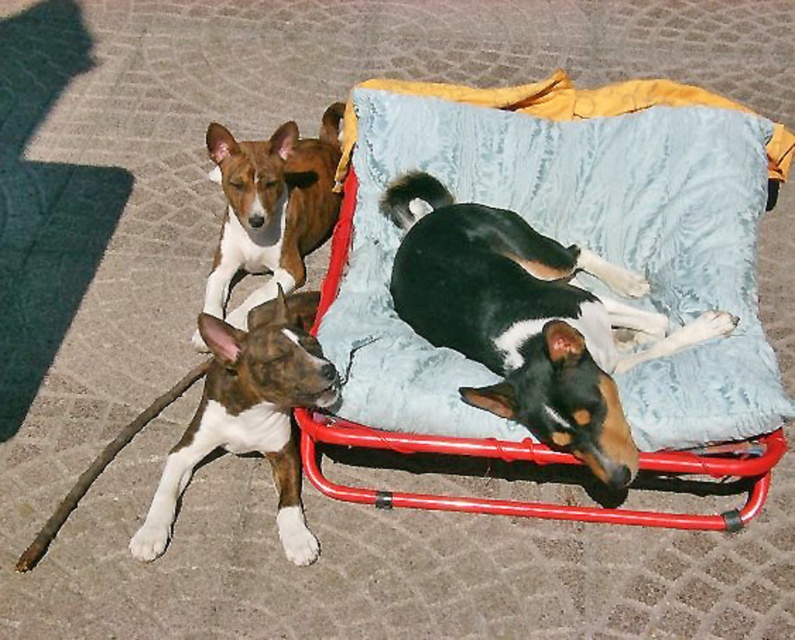
Question: Is black and white fur at center to the left of brown and white fur at lower left from the viewer's perspective?

Choices:
 (A) no
 (B) yes

Answer: (A)

Question: Which object is closer to the camera taking this photo?

Choices:
 (A) brown and white fur at lower left
 (B) black and white fur at center
 (C) brown/white fur dog at upper left
 (D) blue velvety blanket at upper center

Answer: (B)

Question: Does black and white fur at center have a greater width compared to brown and white fur at lower left?

Choices:
 (A) yes
 (B) no

Answer: (A)

Question: Considering the real-world distances, which object is farthest from the brown/white fur dog at upper left?

Choices:
 (A) blue velvety blanket at upper center
 (B) black and white fur at center
 (C) brown and white fur at lower left

Answer: (B)

Question: Which is farther from the brown/white fur dog at upper left?

Choices:
 (A) brown and white fur at lower left
 (B) black and white fur at center
 (C) blue velvety blanket at upper center

Answer: (B)

Question: Is black and white fur at center above brown/white fur dog at upper left?

Choices:
 (A) yes
 (B) no

Answer: (B)